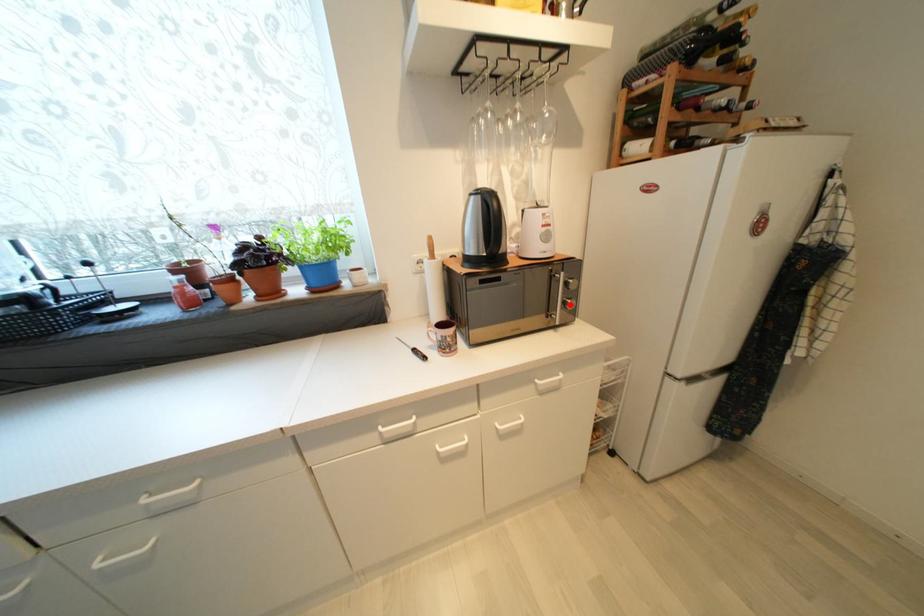
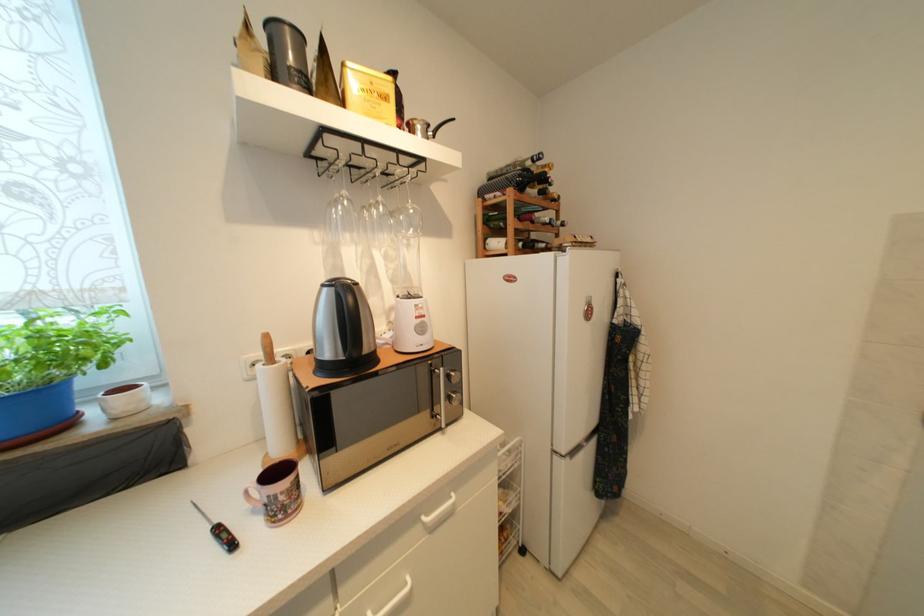
The point at the highlighted location is marked in the first image. Where is the corresponding point in the second image?

(455, 400)